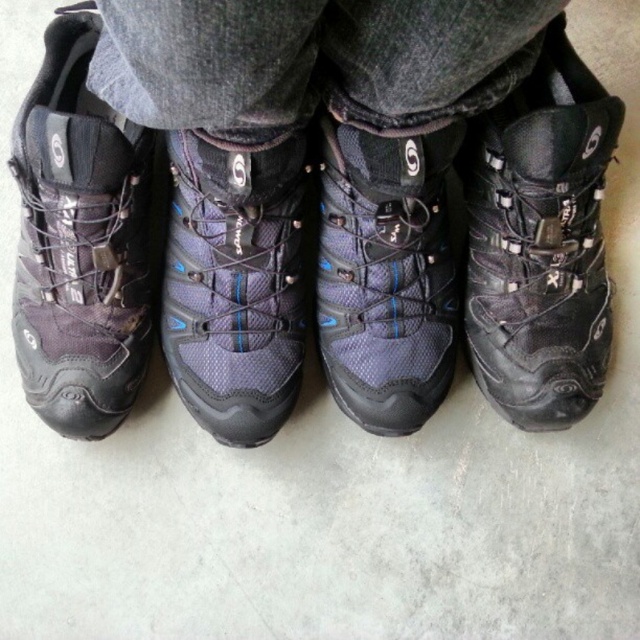
The image size is (640, 640). In order to click on matte black hiking boots at center in this screenshot , I will do `click(317, 211)`.

The height and width of the screenshot is (640, 640). In order to click on matte black hiking boots at center in this screenshot , I will do `click(317, 211)`.

Who is more forward, (x=563, y=360) or (x=177, y=346)?

Positioned in front is point (x=563, y=360).

Does point (445, 42) come in front of point (253, 420)?

Yes, it is in front of point (253, 420).

The width and height of the screenshot is (640, 640). What are the coordinates of `matte black hiking boots at center` in the screenshot? It's located at (317, 211).

Who is lower down, matte black hiking boots at center or matte blue mesh boot at center?

matte blue mesh boot at center

Does matte black hiking boots at center have a larger size compared to matte blue mesh boot at center?

Correct, matte black hiking boots at center is larger in size than matte blue mesh boot at center.

Is point (257, 209) positioned after point (452, 134)?

Yes, point (257, 209) is behind point (452, 134).

Find the location of a particular element. This screenshot has height=640, width=640. matte black hiking boots at center is located at coordinates (317, 211).